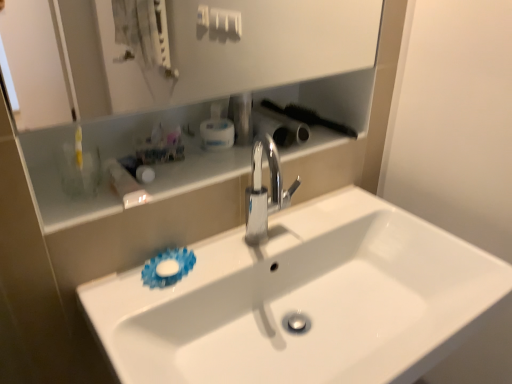
This screenshot has width=512, height=384. I want to click on free spot in front of white plastic mouthwash at upper center, so click(x=207, y=167).